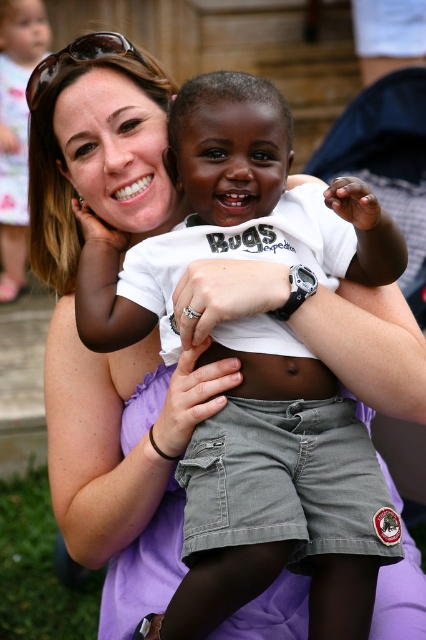
Question: Based on their relative distances, which object is nearer to the matte black hair at upper left?

Choices:
 (A) sunglasses at upper left
 (B) gray cotton shorts at center

Answer: (A)

Question: Can you confirm if matte black hair at upper left is positioned above sunglasses at upper left?

Choices:
 (A) yes
 (B) no

Answer: (A)

Question: Which point is closer to the camera taking this photo?

Choices:
 (A) (19, 172)
 (B) (43, 83)
 (C) (317, 481)
 (D) (290, 376)

Answer: (C)

Question: Does smooth white skin at center appear on the right side of sunglasses at upper left?

Choices:
 (A) no
 (B) yes

Answer: (B)

Question: Can you confirm if matte black hair at upper left is thinner than sunglasses at upper left?

Choices:
 (A) yes
 (B) no

Answer: (B)

Question: Estimate the real-world distances between objects in this image. Which object is farther from the matte black hair at upper left?

Choices:
 (A) sunglasses at upper left
 (B) smooth white skin at center

Answer: (B)